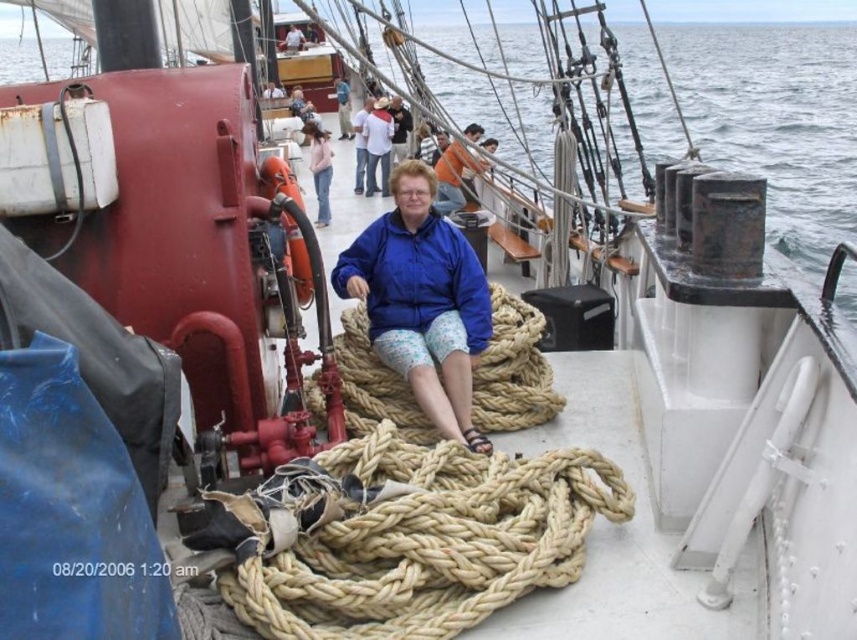
Looking at this image, you are a sailor on the deck of the ship and you notice two items at upper center. Which one is closer to you, the orange fabric shirt at upper center or the light pink fabric at upper center?

The orange fabric shirt at upper center is closer to you because it is in front of the light pink fabric at upper center.

You are a sailor on the deck of the ship and need to secure the natural tan rope at center. Where exactly should you look to find it?

The natural tan rope at center is located at the 2D coordinates point (x=513, y=371).

You are a sailor on the deck of a ship. You need to determine which object takes up more space on the deck between the natural tan rope at lower center and the white cotton shirt at center. Which one is larger?

The natural tan rope at lower center has a larger size compared to the white cotton shirt at center, so the natural tan rope at lower center takes up more space on the deck.